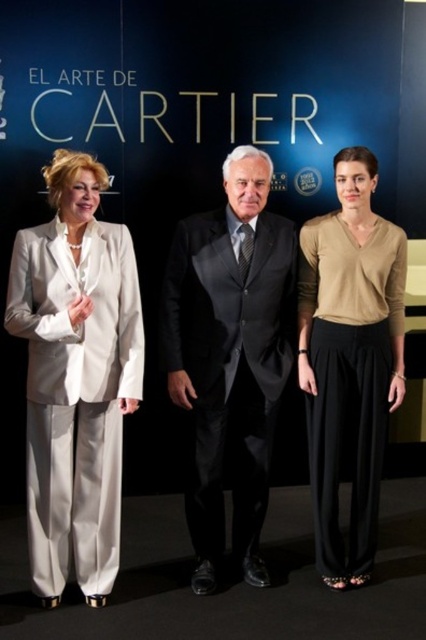
You are attending a formal event and need to decide which outfit to choose between the dark gray suit at center and the beige soft sweater at center. Based on their lengths, which one would be more appropriate for a formal event?

The beige soft sweater at center is longer than the dark gray suit at center. In formal events, longer attire like the beige soft sweater at center is often preferred for a more elegant and sophisticated look.

You are a photographer at the Cartier event and need to adjust the lighting to ensure that the person at point (129, 298) and the person at point (351, 298) are both well lit. Since one is in front of the other, which person should you adjust the lighting for first to avoid casting a shadow on the other?

You should adjust the lighting for the person at point (129, 298) first because they are in front of the person at point (351, 298). By starting with the front person, you can ensure their positioning doesn not cast a shadow over the individual behind them.

Looking at this image, you are a fashion designer observing the scene. You need to decide which garment takes up more horizontal space between the dark gray suit at center and the beige soft sweater at center. Which one is wider?

The dark gray suit at center is wider than the beige soft sweater at center.